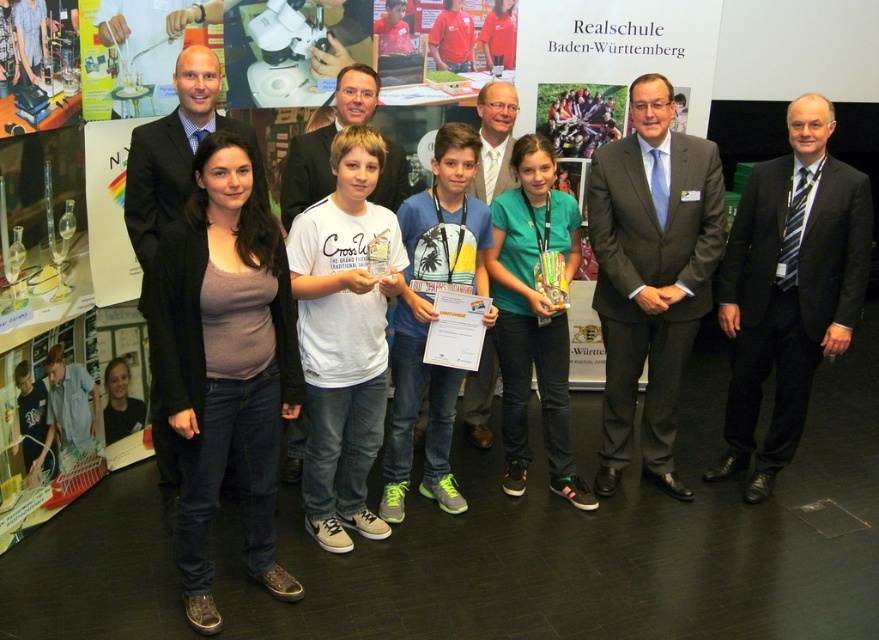
You are a photographer adjusting your camera settings to focus on two specific points in the image. The first point is at coordinates point (838, 273) and the second is at point (471, 438). Which point should you focus on first if you want to ensure both points are in focus?

You should focus on point (838, 273) first because it is closer to the camera than point (471, 438). This ensures the closer point is in focus, and the farther point will also be in focus due to the depth of field.